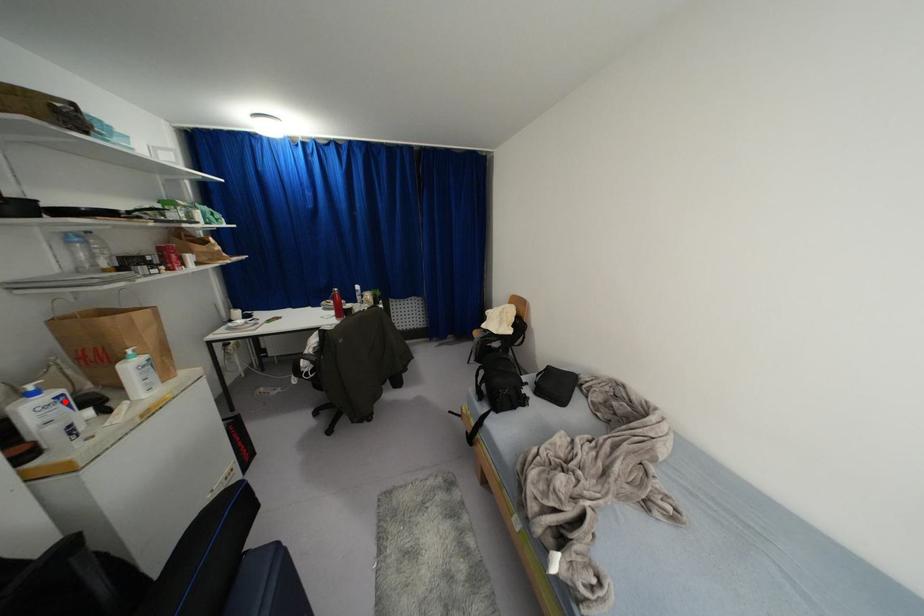
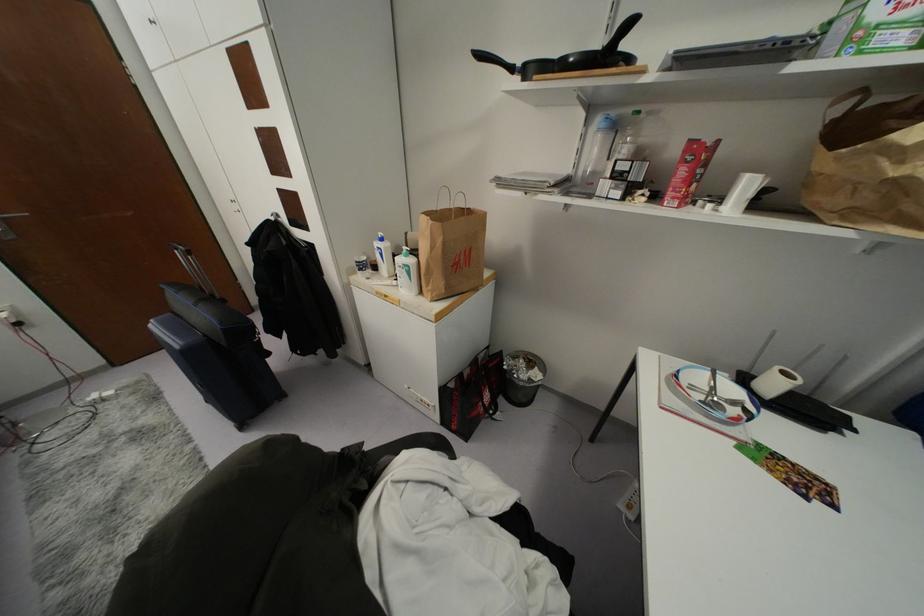
In the second image, find the point that corresponds to the highlighted location in the first image.

(381, 254)